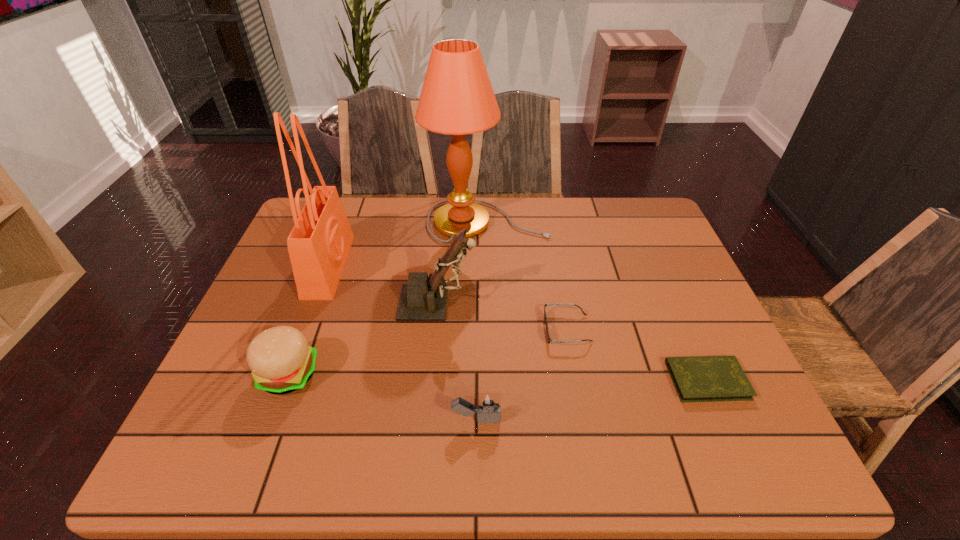
Locate an element on the screen. lamp is located at coordinates (457, 98).

The width and height of the screenshot is (960, 540). In order to click on tote bag in this screenshot , I will do `click(319, 243)`.

Locate an element on the screen. The height and width of the screenshot is (540, 960). the fifth shortest object is located at coordinates (423, 298).

In order to click on hamburger in this screenshot , I will do `click(281, 361)`.

The image size is (960, 540). I want to click on igniter, so click(488, 405).

Find the location of a particular element. This screenshot has height=540, width=960. sunglasses is located at coordinates (551, 304).

Locate an element on the screen. Image resolution: width=960 pixels, height=540 pixels. diary is located at coordinates (701, 378).

Find the location of a particular element. The image size is (960, 540). the shortest object is located at coordinates (701, 378).

The width and height of the screenshot is (960, 540). In order to click on free space located 0.230m on the right of the lamp in this screenshot , I will do `click(622, 221)`.

The height and width of the screenshot is (540, 960). In order to click on free region located on the logo side of the tote bag in this screenshot , I will do `click(452, 266)`.